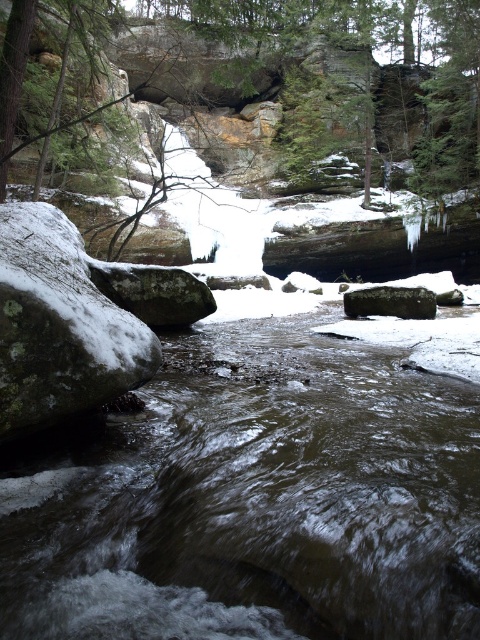
Which is more to the left, lichen-covered rock at left or smooth gray rock at center?

lichen-covered rock at left is more to the left.

Which is in front, point (47, 234) or point (432, 296)?

Point (47, 234)

This screenshot has height=640, width=480. Describe the element at coordinates (59, 324) in the screenshot. I see `lichen-covered rock at left` at that location.

In order to click on lichen-covered rock at left in this screenshot , I will do `click(59, 324)`.

Is lichen-covered rock at left in front of green textured tree at upper center?

Yes, lichen-covered rock at left is in front of green textured tree at upper center.

Who is more distant from viewer, (x=28, y=301) or (x=1, y=120)?

Positioned behind is point (x=1, y=120).

Where is `lichen-covered rock at left`? The width and height of the screenshot is (480, 640). lichen-covered rock at left is located at coordinates (59, 324).

Between point (19, 96) and point (427, 310), which one is positioned in front?

Point (19, 96) is in front.

I want to click on green textured tree at upper center, so pyautogui.click(x=13, y=80).

Identify the location of green textured tree at upper center. (13, 80).